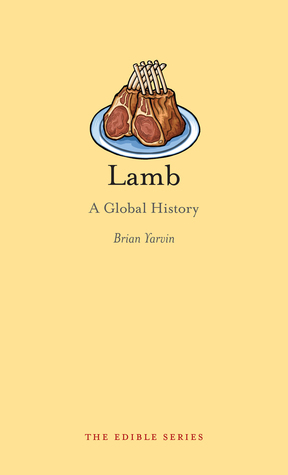
Locate an element on the screen. This screenshot has width=288, height=475. blue plate is located at coordinates (131, 148).